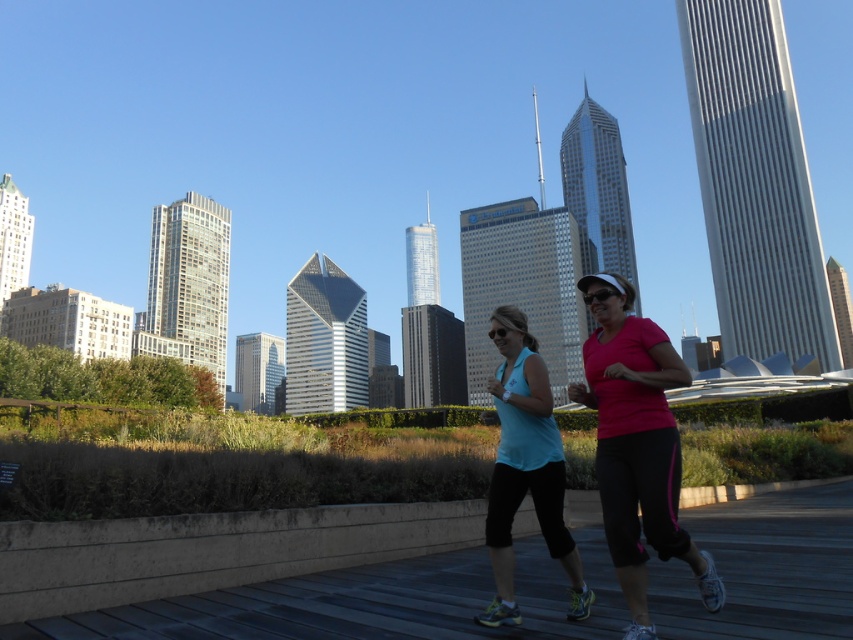
You are a photographer positioned at the end of the wooden pathway. You want to capture a photo where both the matte pink shirt at center and the matte blue tank top at center are clearly visible. However, your camera can only focus on one subject at a time. Which subject should you focus on to ensure the other remains in the background?

You should focus on the matte pink shirt at center because it is taller than the matte blue tank top at center, so the blue one will naturally be in the background.

You are a photographer positioned on the wooden pathway capturing the two joggers. Which jogger, the matte pink shirt at center or the matte blue tank top at center, is positioned to the right side of the other?

The matte pink shirt at center is positioned to the right of the matte blue tank top at center.